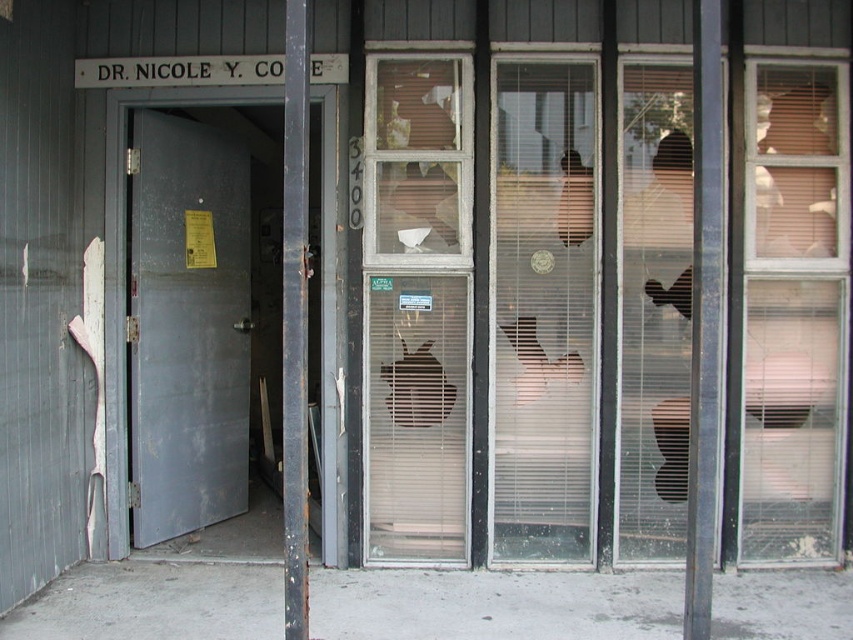
In the scene shown: You are standing in front of the building and want to see through the clear glass window at center. Is the white painted wood sign at upper center blocking your view of the window?

The clear glass window at center is positioned under the white painted wood sign at upper center, so the sign is blocking part of the window from your view.

Looking at this image, you are a delivery person trying to enter the building. The door is partially open, but you need to know if the clear glass window at right is wider than the metallic gray door at left to decide whether to enter through the door or approach the window for assistance. Based on the scene, which one is wider?

The clear glass window at right is wider than the metallic gray door at left, so you should approach the window for assistance since it is wider.